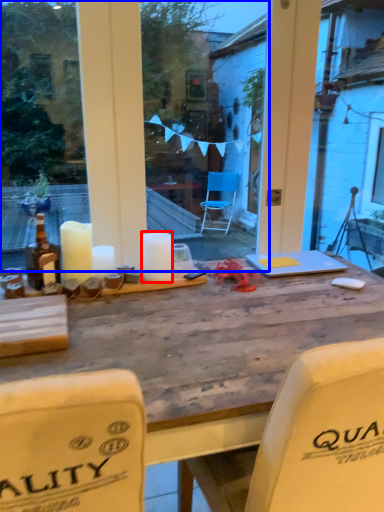
Question: Among these objects, which one is farthest to the camera, candle (highlighted by a red box) or glass window (highlighted by a blue box)?

Choices:
 (A) candle
 (B) glass window

Answer: (A)